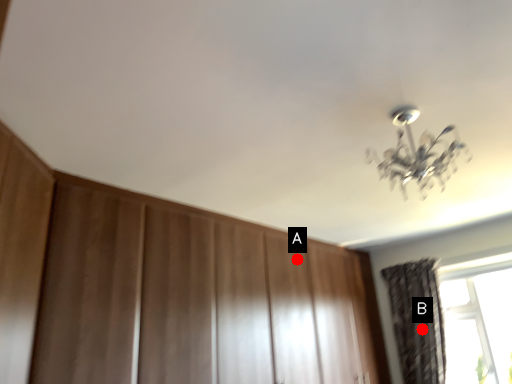
Question: Two points are circled on the image, labeled by A and B beside each circle. Which of the following is the closest to the observer?

Choices:
 (A) A is closer
 (B) B is closer

Answer: (A)